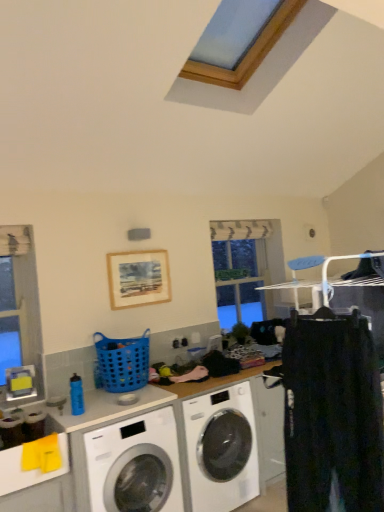
Question: Is blue plastic basket at center surrounded by wooden picture frame at upper center?

Choices:
 (A) no
 (B) yes

Answer: (A)

Question: From the image's perspective, is wooden picture frame at upper center over blue plastic basket at center?

Choices:
 (A) no
 (B) yes

Answer: (B)

Question: Is wooden picture frame at upper center next to blue plastic basket at center and touching it?

Choices:
 (A) yes
 (B) no

Answer: (B)

Question: Does wooden picture frame at upper center have a lesser width compared to blue plastic basket at center?

Choices:
 (A) no
 (B) yes

Answer: (B)

Question: From a real-world perspective, is wooden picture frame at upper center under blue plastic basket at center?

Choices:
 (A) no
 (B) yes

Answer: (A)

Question: Considering the positions of black cotton pants at right and blue plastic basket at center in the image, is black cotton pants at right taller or shorter than blue plastic basket at center?

Choices:
 (A) short
 (B) tall

Answer: (B)

Question: Considering the positions of black cotton pants at right and blue plastic basket at center in the image, is black cotton pants at right bigger or smaller than blue plastic basket at center?

Choices:
 (A) small
 (B) big

Answer: (B)

Question: From a real-world perspective, is black cotton pants at right positioned above or below blue plastic basket at center?

Choices:
 (A) below
 (B) above

Answer: (A)

Question: Is black cotton pants at right wider or thinner than blue plastic basket at center?

Choices:
 (A) wide
 (B) thin

Answer: (B)

Question: Is clear glass window at center in front of or behind black cotton pants at right in the image?

Choices:
 (A) front
 (B) behind

Answer: (B)

Question: Is clear glass window at center taller or shorter than black cotton pants at right?

Choices:
 (A) tall
 (B) short

Answer: (A)

Question: Considering the positions of point (263, 304) and point (316, 490), is point (263, 304) closer or farther from the camera than point (316, 490)?

Choices:
 (A) closer
 (B) farther

Answer: (B)

Question: Based on their positions, is clear glass window at center located to the left or right of black cotton pants at right?

Choices:
 (A) left
 (B) right

Answer: (B)

Question: Is clear glass window at center bigger or smaller than white glossy washing machine at lower left, which is the second washing machine from right to left?

Choices:
 (A) big
 (B) small

Answer: (B)

Question: Considering the relative positions of clear glass window at center and white glossy washing machine at lower left, which is the second washing machine from right to left, in the image provided, is clear glass window at center to the left or to the right of white glossy washing machine at lower left, which is the second washing machine from right to left,?

Choices:
 (A) right
 (B) left

Answer: (A)